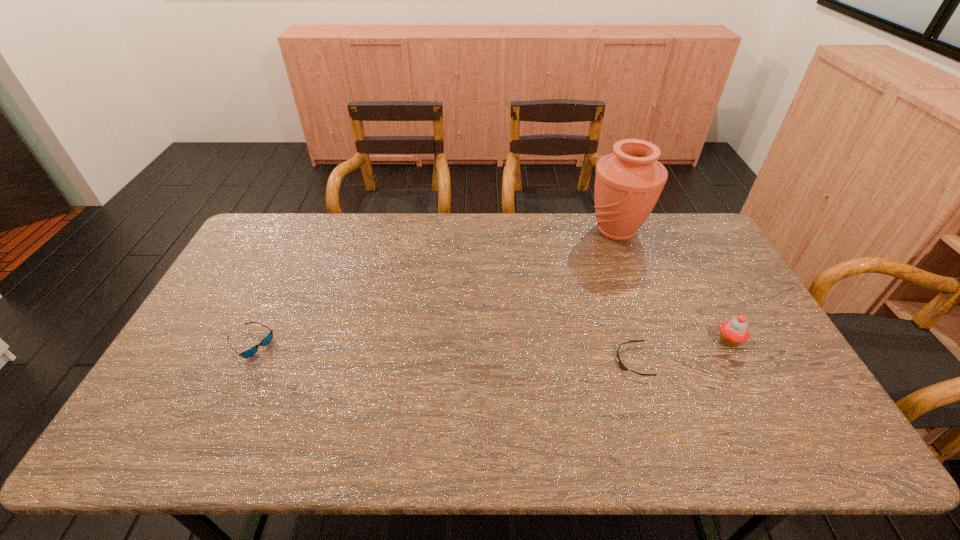
In the image, there is a desktop. Where is `vacant space at the near left corner`? vacant space at the near left corner is located at coordinates (126, 453).

Identify the location of vacant space that is in between the second shortest object and the shortest object. Image resolution: width=960 pixels, height=540 pixels. (442, 353).

At what (x,y) coordinates should I click in order to perform the action: click on free space between the rightmost object and the leftmost object. Please return your answer as a coordinate pair (x, y). This screenshot has height=540, width=960. Looking at the image, I should click on (490, 342).

Identify the location of free spot between the farthest object and the leftmost object. This screenshot has height=540, width=960. (433, 287).

This screenshot has width=960, height=540. I want to click on empty space that is in between the second shortest object and the shortest object, so click(x=442, y=353).

Where is `free spot between the shortest object and the farthest object`? The image size is (960, 540). free spot between the shortest object and the farthest object is located at coordinates (625, 296).

Where is `free space that is in between the vase and the cupcake`? free space that is in between the vase and the cupcake is located at coordinates (673, 286).

Find the location of a particular element. This screenshot has width=960, height=540. vacant area that lies between the shortest object and the tallest object is located at coordinates (625, 296).

Identify the location of vacant area that lies between the third shortest object and the farthest object. The image size is (960, 540). (673, 286).

The width and height of the screenshot is (960, 540). Identify the location of free space between the second tallest object and the shortest object. (681, 350).